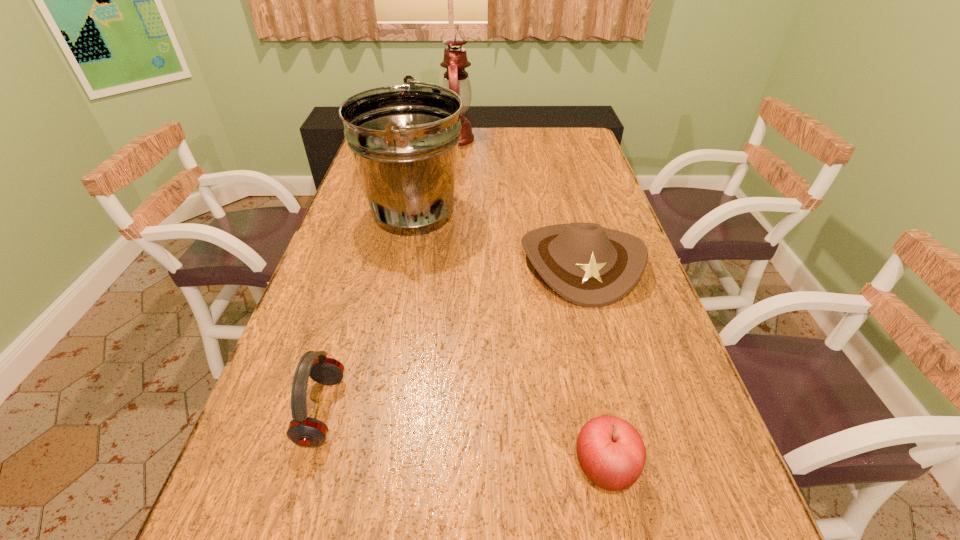
Where is `vacant area that lies between the oil lamp and the cowboy hat`? The height and width of the screenshot is (540, 960). vacant area that lies between the oil lamp and the cowboy hat is located at coordinates (519, 200).

This screenshot has width=960, height=540. I want to click on free point between the cowboy hat and the bucket, so click(x=497, y=237).

Image resolution: width=960 pixels, height=540 pixels. Identify the location of free space that is in between the apple and the earphone. pyautogui.click(x=463, y=440).

I want to click on object identified as the third closest to the earphone, so click(611, 452).

Locate an element on the screen. The image size is (960, 540). object that ranks as the second closest to the cowboy hat is located at coordinates (611, 452).

At what (x,y) coordinates should I click in order to perform the action: click on vacant space that satisfies the following two spatial constraints: 1. with a star on the front of the cowboy hat; 2. on the ear cups of the earphone. Please return your answer as a coordinate pair (x, y). The height and width of the screenshot is (540, 960). Looking at the image, I should click on (619, 410).

Find the location of a particular element. vacant space that satisfies the following two spatial constraints: 1. on the front side of the farthest object; 2. on the left side of the apple is located at coordinates (430, 469).

Identify the location of free spot that satisfies the following two spatial constraints: 1. on the front side of the apple; 2. on the left side of the oil lamp. (430, 469).